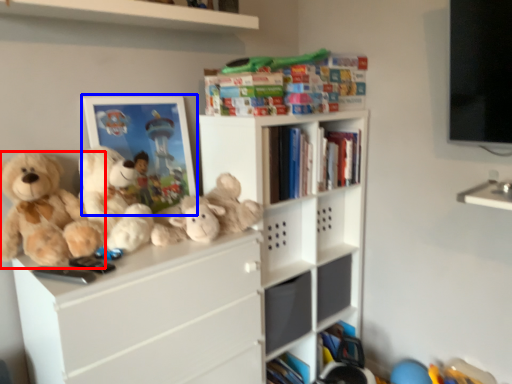
Question: Among these objects, which one is nearest to the camera, teddy bear (highlighted by a red box) or picture frame (highlighted by a blue box)?

Choices:
 (A) teddy bear
 (B) picture frame

Answer: (A)